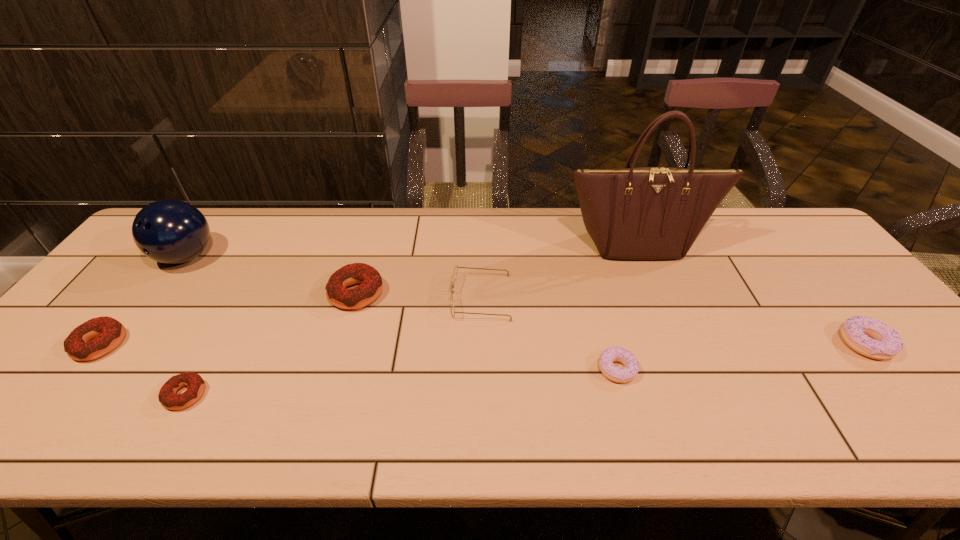
Locate which chocolate doughnut is the second closest to the nearest chocolate doughnut. Please provide its 2D coordinates. Your answer should be formatted as a tuple, i.e. [(x, y)], where the tuple contains the x and y coordinates of a point satisfying the conditions above.

[(371, 285)]

Locate an element on the screen. This screenshot has width=960, height=540. vacant point that satisfies the following two spatial constraints: 1. on the surface of the blue bowling ball near the finger holes; 2. on the right side of the rightmost doughnut is located at coordinates (122, 343).

The height and width of the screenshot is (540, 960). I want to click on vacant point that satisfies the following two spatial constraints: 1. on the surface of the smaller purple doughnut near the finger holes; 2. on the right side of the bowling ball, so click(x=102, y=369).

You are a GUI agent. You are given a task and a screenshot of the screen. Output one action in this format:
    pyautogui.click(x=<x>, y=<y>)
    Task: Click on the free space that satisfies the following two spatial constraints: 1. on the surface of the bowling ball near the finger holes; 2. on the left side of the fourth object from left to right
    The height and width of the screenshot is (540, 960).
    Given the screenshot: What is the action you would take?
    pyautogui.click(x=159, y=293)

At what (x,y) coordinates should I click in order to perform the action: click on free region that satisfies the following two spatial constraints: 1. on the front side of the left purple doughnut; 2. on the left side of the second smallest chocolate doughnut. Please return your answer as a coordinate pair (x, y). This screenshot has width=960, height=540. Looking at the image, I should click on (80, 369).

I want to click on vacant region that satisfies the following two spatial constraints: 1. on the surface of the blue bowling ball near the finger holes; 2. on the left side of the bigger purple doughnut, so click(x=122, y=343).

At what (x,y) coordinates should I click in order to perform the action: click on free space that satisfies the following two spatial constraints: 1. on the front-facing side of the beige spectacles; 2. on the left side of the bigger purple doughnut. Please return your answer as a coordinate pair (x, y). This screenshot has height=540, width=960. Looking at the image, I should click on (481, 343).